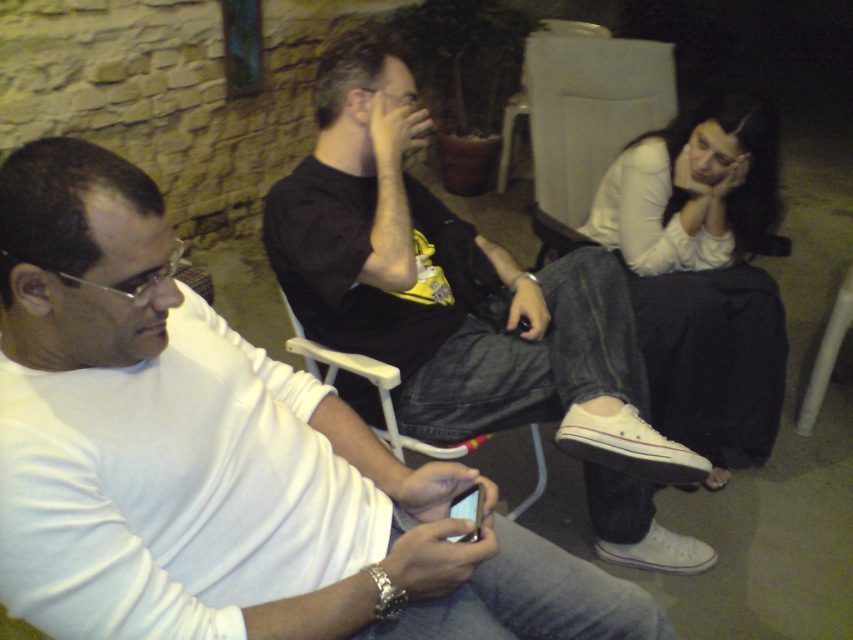
Describe the element at coordinates (221, 461) in the screenshot. I see `white matte shirt at left` at that location.

Is point (82, 417) closer to camera compared to point (766, 396)?

That is True.

Image resolution: width=853 pixels, height=640 pixels. I want to click on white matte shirt at left, so click(221, 461).

Between point (401, 211) and point (722, 262), which one is positioned in front?

Point (401, 211)

Does black matte shirt at center appear over white matte shirt at lower right?

No.

Measure the distance between point (646, 477) and camera.

Point (646, 477) and camera are 5.04 feet apart from each other.

At what (x,y) coordinates should I click in order to perform the action: click on black matte shirt at center. Please return your answer as a coordinate pair (x, y). This screenshot has width=853, height=640. Looking at the image, I should click on (465, 310).

Can you confirm if white matte shirt at left is positioned below matte black smartphone at lower center?

No.

Who is positioned more to the left, white matte shirt at left or matte black smartphone at lower center?

white matte shirt at left is more to the left.

Who is more distant from viewer, (86, 481) or (480, 499)?

The point (480, 499) is more distant.

Locate an element on the screen. The width and height of the screenshot is (853, 640). white matte shirt at left is located at coordinates (221, 461).